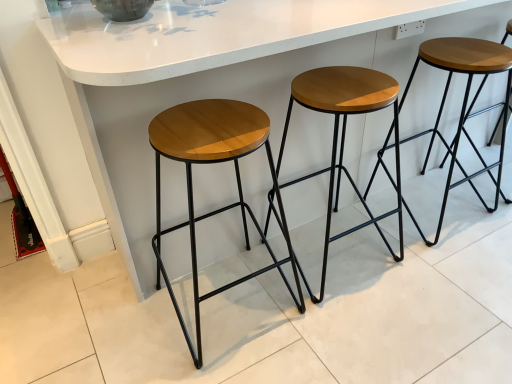
You are a GUI agent. You are given a task and a screenshot of the screen. Output one action in this format:
    pyautogui.click(x=<x>, y=<y>)
    Task: Click on the vacant area located to the right-hand side of wooden/matte stool at center, marked as the 2th stool in a left-to-right arrangement
    
    Given the screenshot: What is the action you would take?
    pyautogui.click(x=426, y=266)